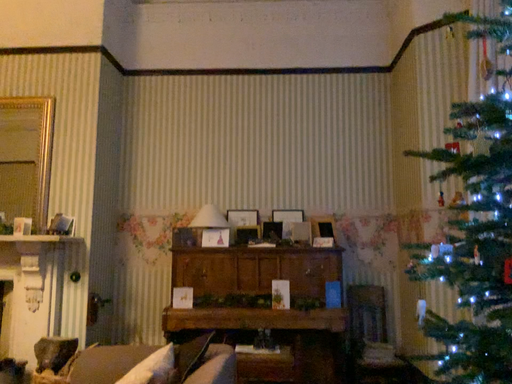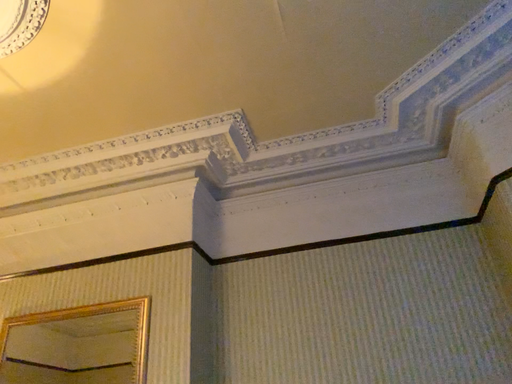
Question: How did the camera likely rotate when shooting the video?

Choices:
 (A) rotated upward
 (B) rotated downward

Answer: (A)